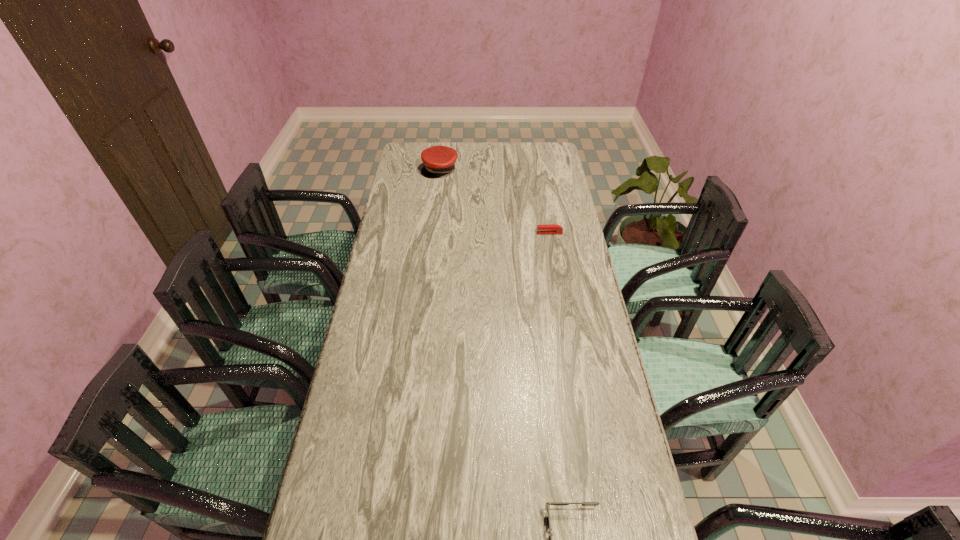
Locate an element on the screen. The image size is (960, 540). object present at the far left corner is located at coordinates (439, 160).

Find the location of a particular element. The width and height of the screenshot is (960, 540). vacant space at the far edge is located at coordinates (482, 148).

What are the coordinates of `free space at the left edge` in the screenshot? It's located at (386, 350).

Where is `vacant space at the right edge of the desktop`? This screenshot has height=540, width=960. vacant space at the right edge of the desktop is located at coordinates (586, 376).

Locate an element on the screen. This screenshot has height=540, width=960. vacant space at the far right corner is located at coordinates (536, 145).

Find the location of a particular element. Image resolution: width=960 pixels, height=540 pixels. free space between the stapler and the cap is located at coordinates (494, 201).

Choose which object is the nearest neighbor to the tallest object. Please provide its 2D coordinates. Your answer should be formatted as a tuple, i.e. [(x, y)], where the tuple contains the x and y coordinates of a point satisfying the conditions above.

[(547, 228)]

Image resolution: width=960 pixels, height=540 pixels. I want to click on the closest object to the cap, so click(547, 228).